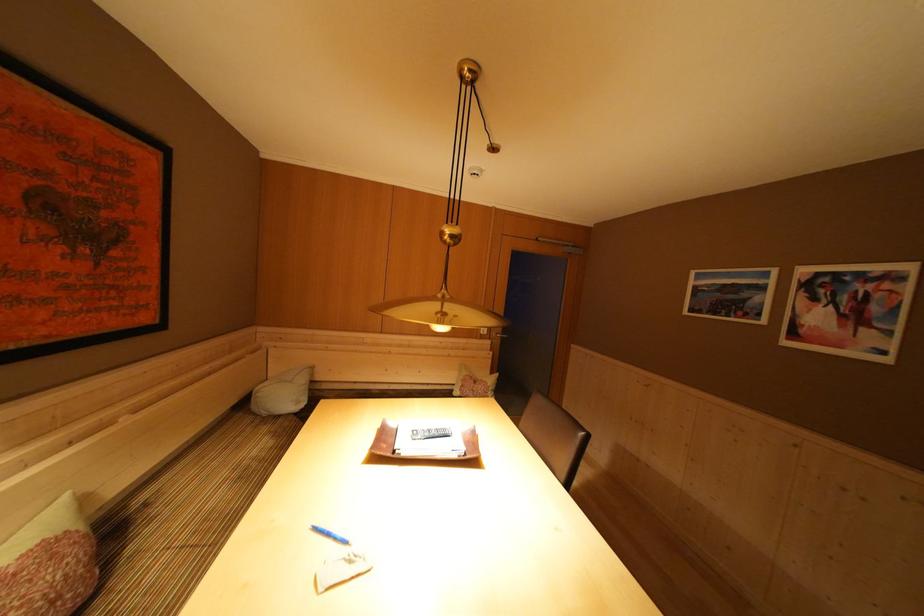
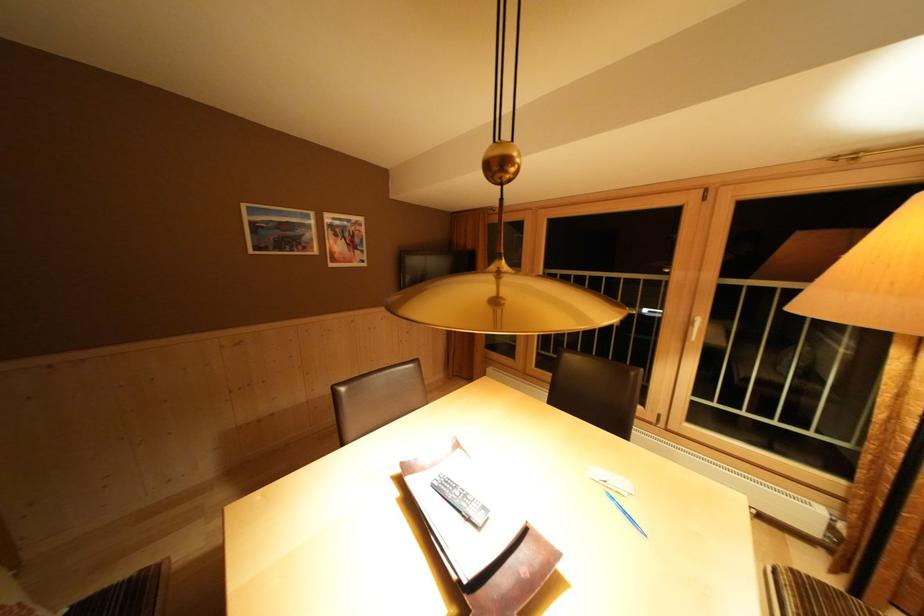
The point at (335,539) is marked in the first image. Where is the corresponding point in the second image?

(633, 517)